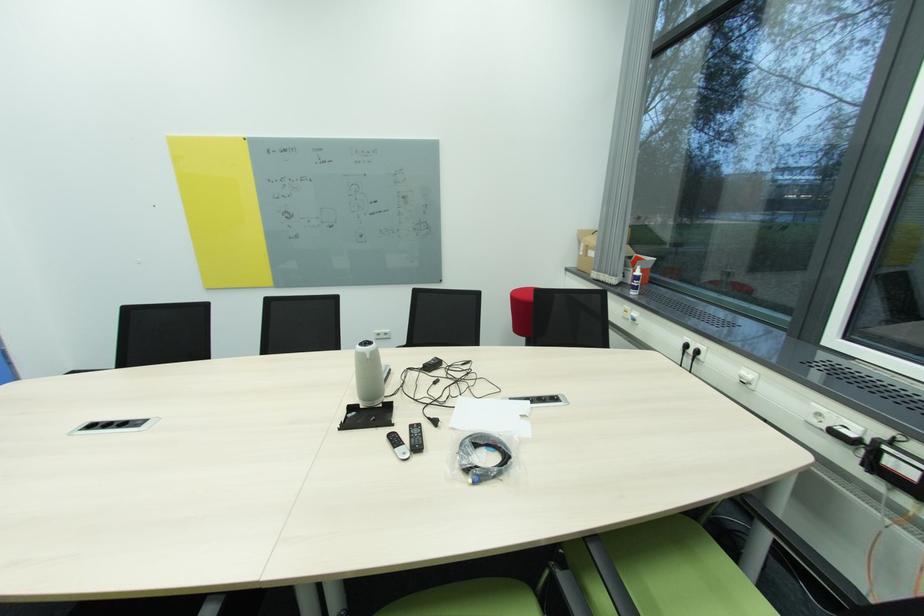
Image resolution: width=924 pixels, height=616 pixels. Find the location of `black cable in bag`. black cable in bag is located at coordinates (x=442, y=384).